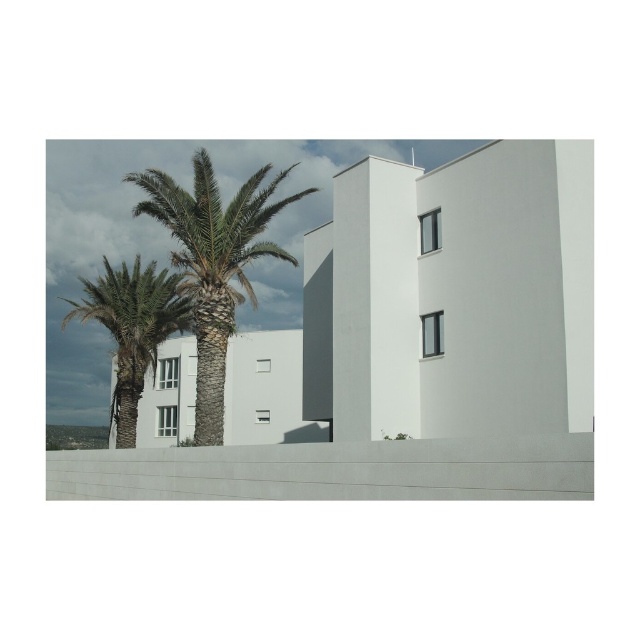
Question: Which object is closer to the camera taking this photo?

Choices:
 (A) green leafy palm tree at center
 (B) green leafy palm tree at left

Answer: (A)

Question: Does green leafy palm tree at center appear over green leafy palm tree at left?

Choices:
 (A) no
 (B) yes

Answer: (B)

Question: Is green leafy palm tree at center to the left of green leafy palm tree at left from the viewer's perspective?

Choices:
 (A) yes
 (B) no

Answer: (B)

Question: Can you confirm if green leafy palm tree at center is positioned above green leafy palm tree at left?

Choices:
 (A) yes
 (B) no

Answer: (A)

Question: Which object is farther from the camera taking this photo?

Choices:
 (A) green leafy palm tree at left
 (B) green leafy palm tree at center

Answer: (A)

Question: Which object appears closest to the camera in this image?

Choices:
 (A) green leafy palm tree at left
 (B) green leafy palm tree at center

Answer: (B)